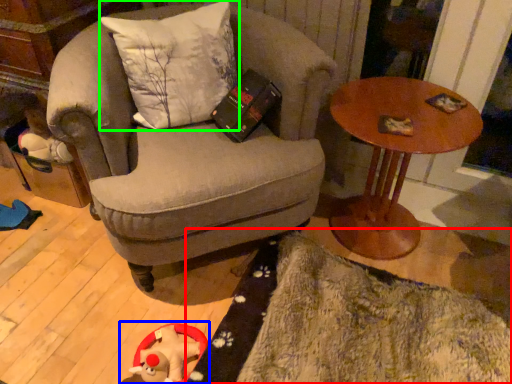
Question: Based on their relative distances, which object is farther from mat (highlighted by a red box)? Choose from toy (highlighted by a blue box) and pillow (highlighted by a green box).

Choices:
 (A) toy
 (B) pillow

Answer: (B)